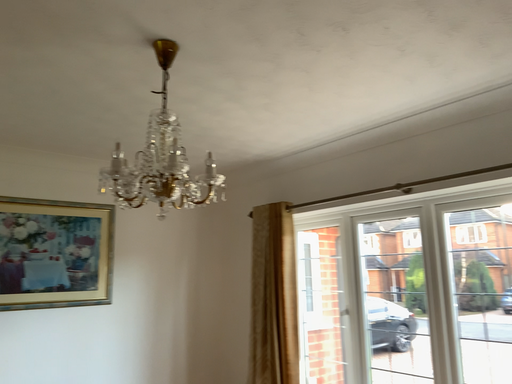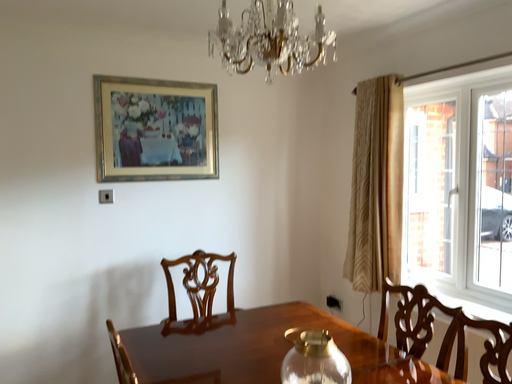
Question: How did the camera likely rotate when shooting the video?

Choices:
 (A) rotated left
 (B) rotated right

Answer: (A)